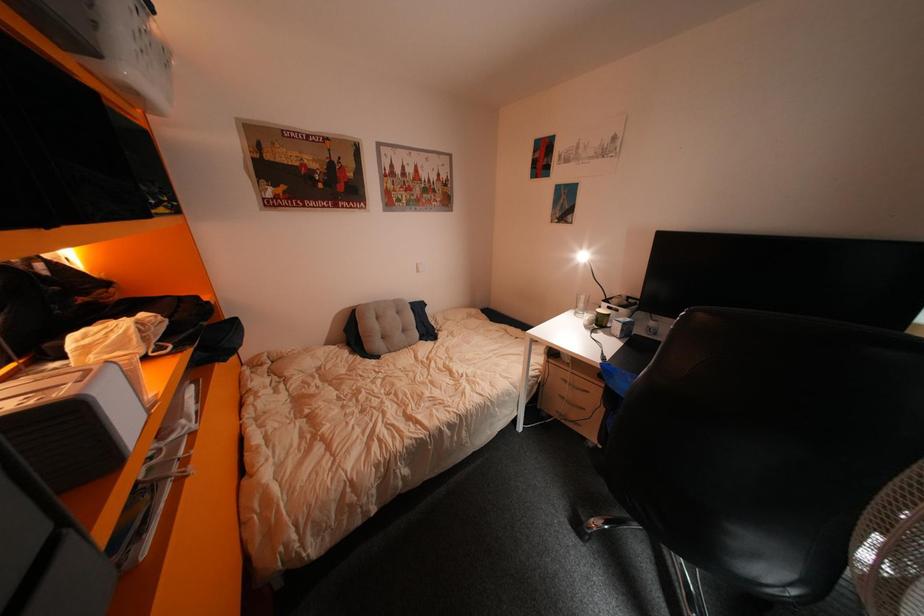
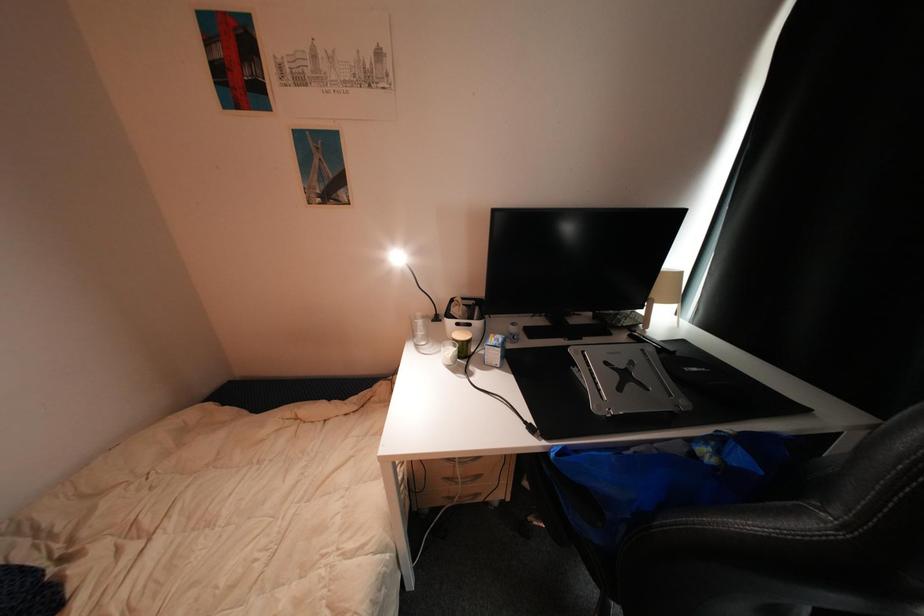
Question: The camera is either moving clockwise (left) or counter-clockwise (right) around the object. The first image is from the beginning of the video and the second image is from the end. Is the camera moving left or right when shooting the video?

Choices:
 (A) Left
 (B) Right

Answer: (A)